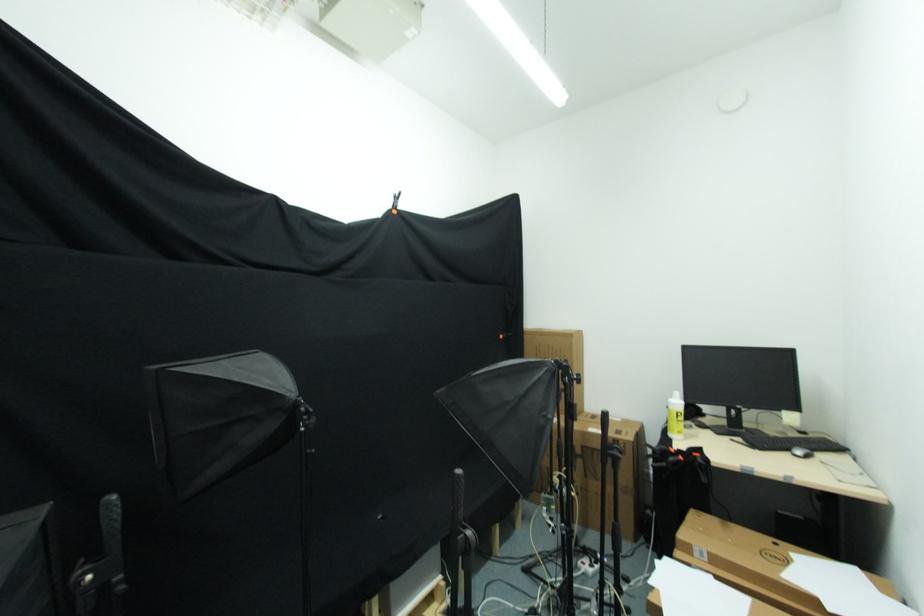
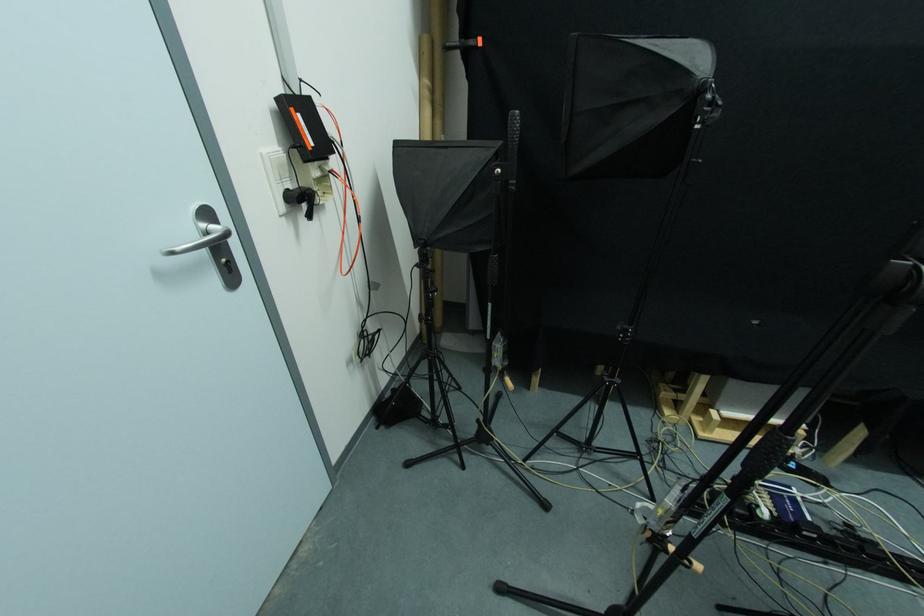
Where in the second image is the point corresponding to pixel 118 586 from the first image?

(515, 187)